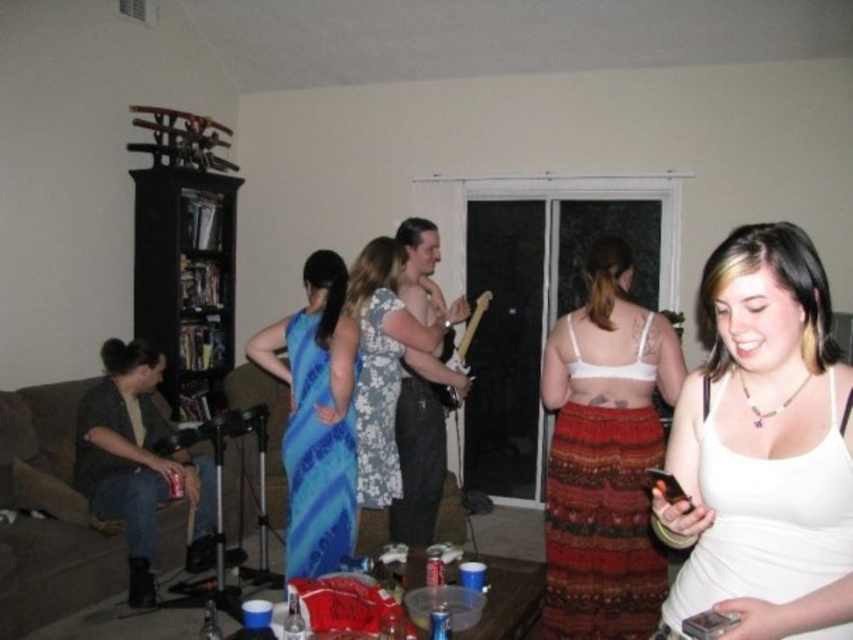
Where is the floral dress at center located in the image?

The floral dress at center is located at point [387,372].

You are standing in the living room and want to take a photo of the point at coordinates point [358,380]. Your camera has a focal length of 50mm and a sensor size of 24mm. What is the minimum distance you need to be from the point to ensure it fills the frame?

The point at [358,380] is 3.14 meters from the camera. Using the formula distance_to_subject divided by focal_length multiplied by sensor_size, the calculation would be 3.14 meters divided by 50mm multiplied by 24mm, resulting in approximately 1.52 meters. Therefore, you need to be at least 1.52 meters away from the point to ensure it fills the frame.